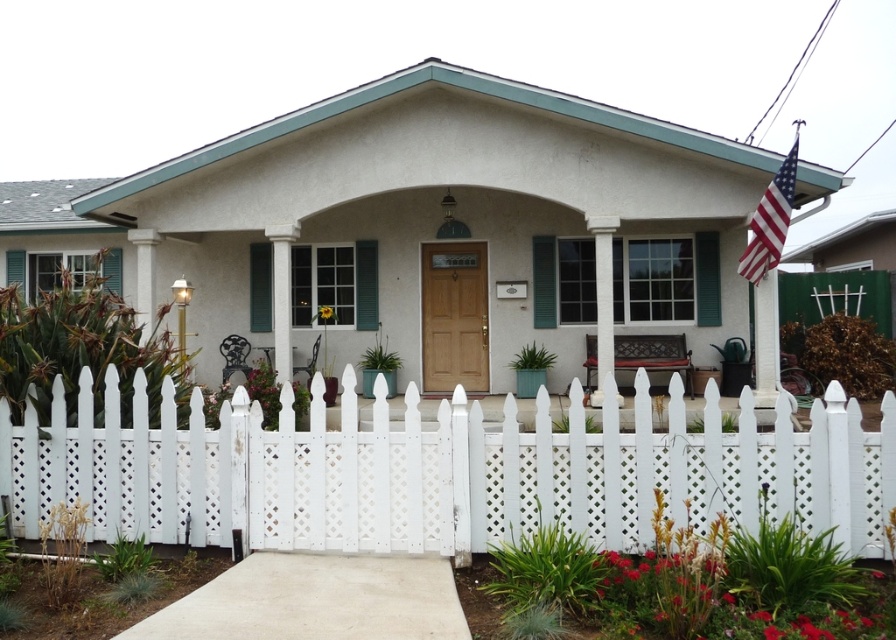
Who is more distant from viewer, (149, 474) or (750, 257)?

The point (750, 257) is behind.

Does point (112, 416) come behind point (739, 262)?

No, (112, 416) is closer to viewer.

Where is `white picket fence at center`? This screenshot has width=896, height=640. white picket fence at center is located at coordinates (441, 472).

The image size is (896, 640). In order to click on white picket fence at center in this screenshot , I will do `click(441, 472)`.

Who is taller, white picket fence at center or white painted wood column at center?

With more height is white painted wood column at center.

Is white picket fence at center shorter than white painted wood column at center?

Indeed, white picket fence at center has a lesser height compared to white painted wood column at center.

Is point (696, 474) less distant than point (600, 358)?

Yes, it is in front of point (600, 358).

The image size is (896, 640). Find the location of `white picket fence at center`. white picket fence at center is located at coordinates (441, 472).

Can you confirm if american flag at upper right is bigger than white painted wood column at center?

Correct, american flag at upper right is larger in size than white painted wood column at center.

Who is more forward, (774,204) or (610,332)?

Positioned in front is point (774,204).

Is point (767, 193) farther from viewer compared to point (588, 224)?

No.

Where is `american flag at upper right`? The width and height of the screenshot is (896, 640). american flag at upper right is located at coordinates (770, 220).